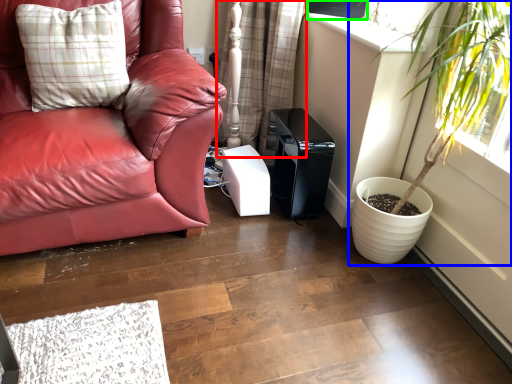
Question: Considering the real-world distances, which object is closest to curtain (highlighted by a red box)? houseplant (highlighted by a blue box) or window screen (highlighted by a green box).

Choices:
 (A) houseplant
 (B) window screen

Answer: (B)